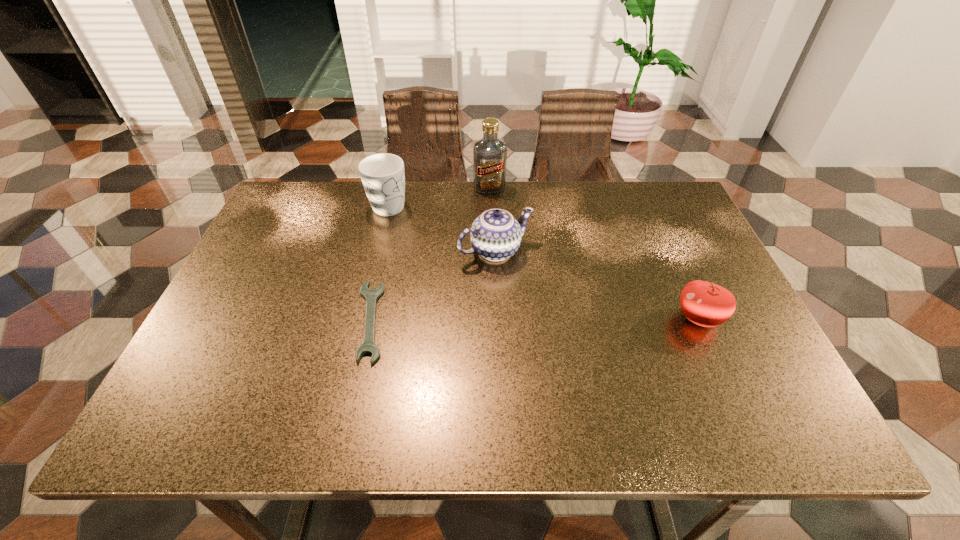
Identify the location of wrench. pyautogui.click(x=368, y=346).

Locate an element on the screen. The image size is (960, 540). the rightmost object is located at coordinates (706, 304).

Find the location of a particular element. The width and height of the screenshot is (960, 540). apple is located at coordinates (706, 304).

Where is `chinaware`? The height and width of the screenshot is (540, 960). chinaware is located at coordinates (495, 235).

The width and height of the screenshot is (960, 540). Identify the location of mug. pos(383,177).

Locate an element on the screen. This screenshot has height=540, width=960. the tallest object is located at coordinates (489, 153).

This screenshot has width=960, height=540. What are the coordinates of `vacant area located on the left of the wrench` in the screenshot? It's located at (239, 321).

Image resolution: width=960 pixels, height=540 pixels. What are the coordinates of `free space located 0.160m on the left of the rightmost object` in the screenshot? It's located at (605, 318).

Identify the location of vacant point located at the spout of the third farthest object. Image resolution: width=960 pixels, height=540 pixels. (550, 311).

Where is `free spot located 0.190m at the spout of the third farthest object`? free spot located 0.190m at the spout of the third farthest object is located at coordinates (556, 316).